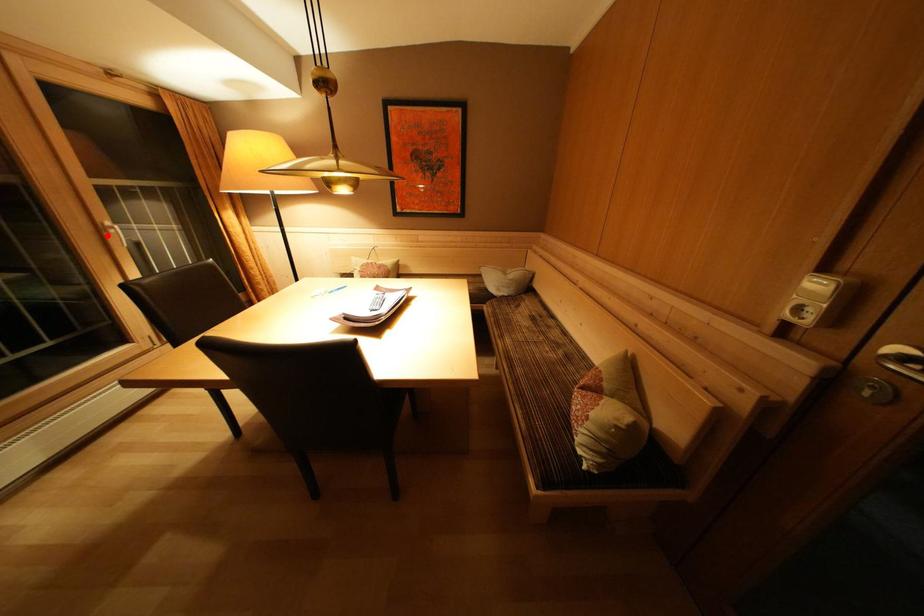
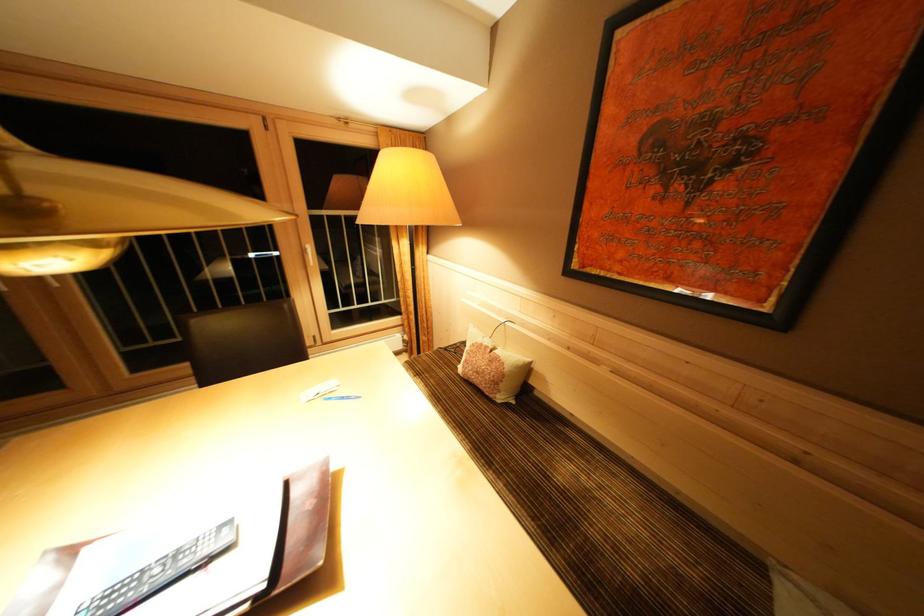
Question: I am providing you with two images of the same scene from different viewpoints. A red point is marked on the first image. At the location where the point appears in image 1, is it still visible in image 2?

Choices:
 (A) Yes
 (B) No

Answer: (A)